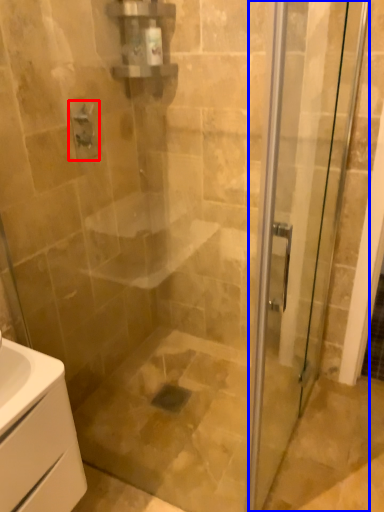
Question: Which point is closer to the camera, shower (highlighted by a red box) or door (highlighted by a blue box)?

Choices:
 (A) shower
 (B) door

Answer: (B)